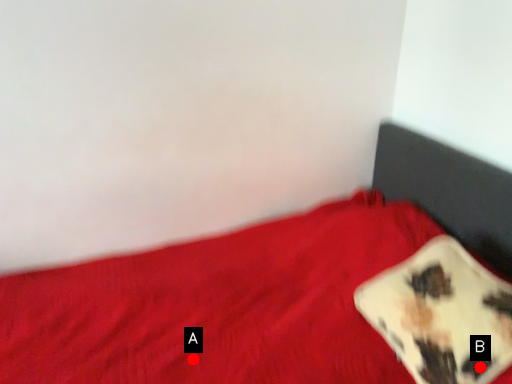
Question: Two points are circled on the image, labeled by A and B beside each circle. Which of the following is the farthest from the observer?

Choices:
 (A) A is further
 (B) B is further

Answer: (A)